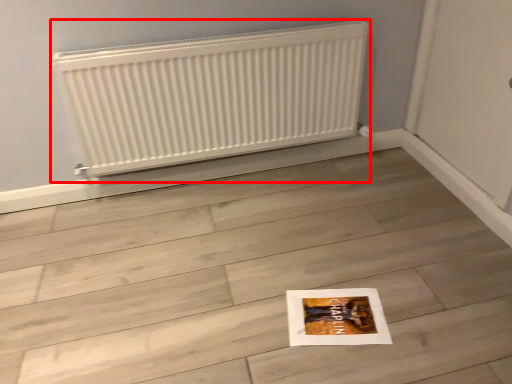
Question: From the image's perspective, what is the correct spatial relationship of radiator (annotated by the red box) in relation to tile?

Choices:
 (A) below
 (B) above

Answer: (B)